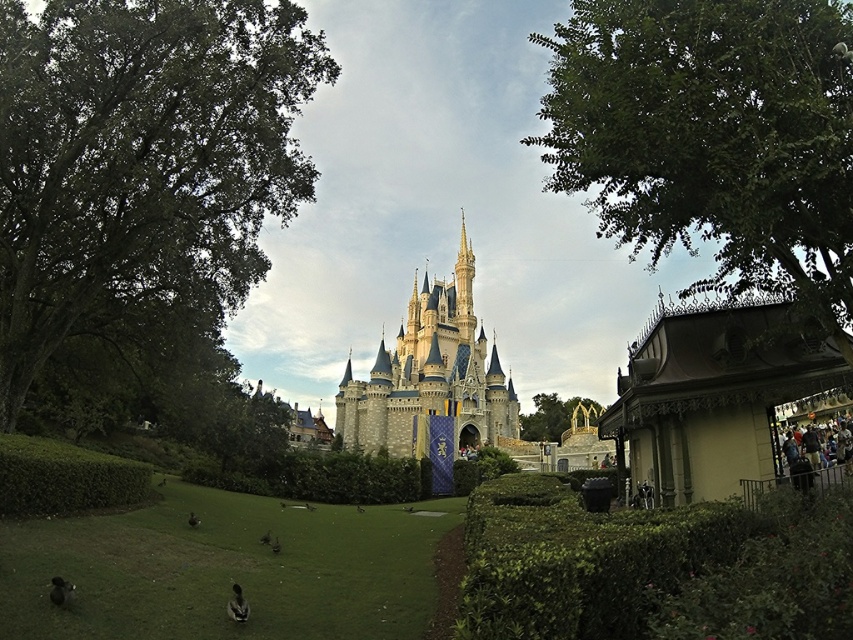
Question: Among these objects, which one is farthest from the camera?

Choices:
 (A) green leafy hedge at lower left
 (B) stone castle at center
 (C) green leafy hedge at lower right

Answer: (B)

Question: Which object appears farthest from the camera in this image?

Choices:
 (A) stone castle at center
 (B) green leafy hedge at lower left

Answer: (A)

Question: Can you confirm if green leafy hedge at lower right is thinner than green leafy hedge at lower left?

Choices:
 (A) yes
 (B) no

Answer: (B)

Question: Can you confirm if green leafy hedge at lower right is positioned below stone castle at center?

Choices:
 (A) yes
 (B) no

Answer: (A)

Question: Estimate the real-world distances between objects in this image. Which object is farther from the green leafy hedge at lower right?

Choices:
 (A) green leafy hedge at lower left
 (B) stone castle at center

Answer: (A)

Question: Can you confirm if green leafy hedge at lower right is wider than stone castle at center?

Choices:
 (A) yes
 (B) no

Answer: (A)